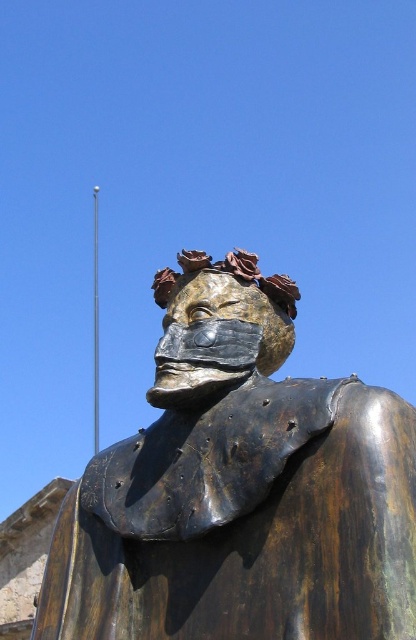
Question: Which of the following is the farthest from the observer?

Choices:
 (A) (403, 634)
 (B) (210, 348)

Answer: (B)

Question: Where is bronze statue at center located in relation to bronze mask at center in the image?

Choices:
 (A) left
 (B) right

Answer: (B)

Question: Which point is closer to the camera?

Choices:
 (A) (228, 276)
 (B) (326, 550)

Answer: (B)

Question: Does bronze statue at center appear under bronze mask at center?

Choices:
 (A) no
 (B) yes

Answer: (B)

Question: Does bronze statue at center appear over bronze mask at center?

Choices:
 (A) no
 (B) yes

Answer: (A)